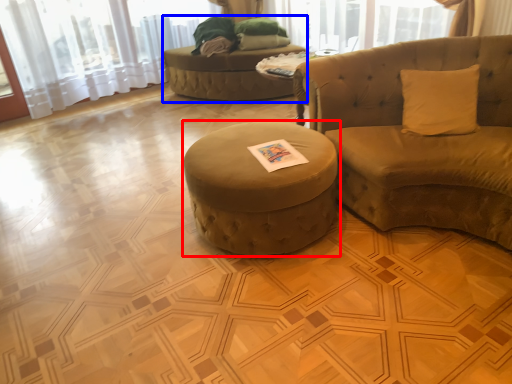
Question: Which object appears closest to the camera in this image, table (highlighted by a red box) or bean bag chair (highlighted by a blue box)?

Choices:
 (A) table
 (B) bean bag chair

Answer: (A)